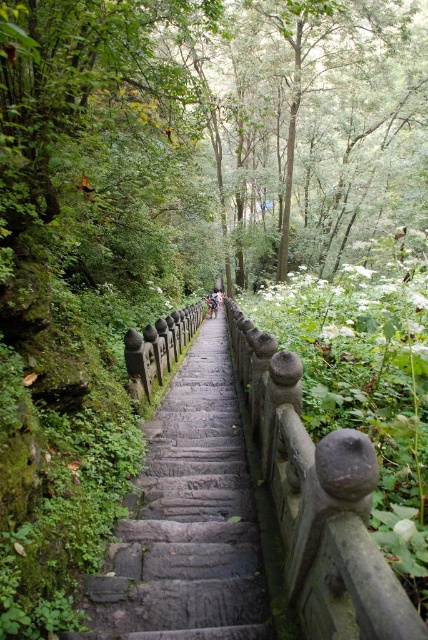
Question: Is gray stone stairs at center above light brown wooden stick at center?

Choices:
 (A) no
 (B) yes

Answer: (A)

Question: Can you confirm if gray stone stairs at center is positioned to the right of light brown wooden stick at center?

Choices:
 (A) no
 (B) yes

Answer: (A)

Question: Does gray stone stairs at center appear on the left side of light brown wooden stick at center?

Choices:
 (A) no
 (B) yes

Answer: (B)

Question: Which of the following is the farthest from the observer?

Choices:
 (A) light brown wooden stick at center
 (B) gray stone stairs at center

Answer: (A)

Question: Which point is closer to the camera?

Choices:
 (A) (171, 552)
 (B) (214, 298)

Answer: (A)